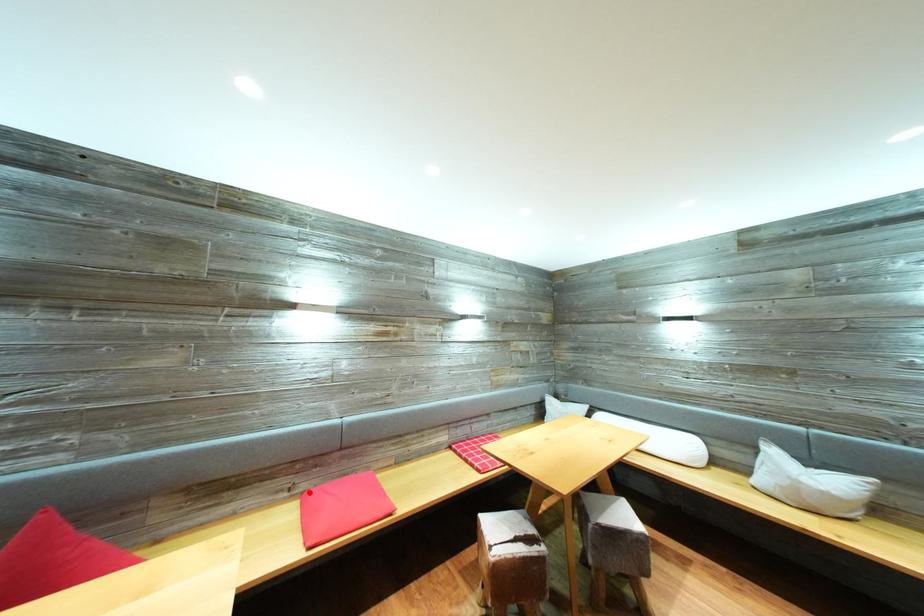
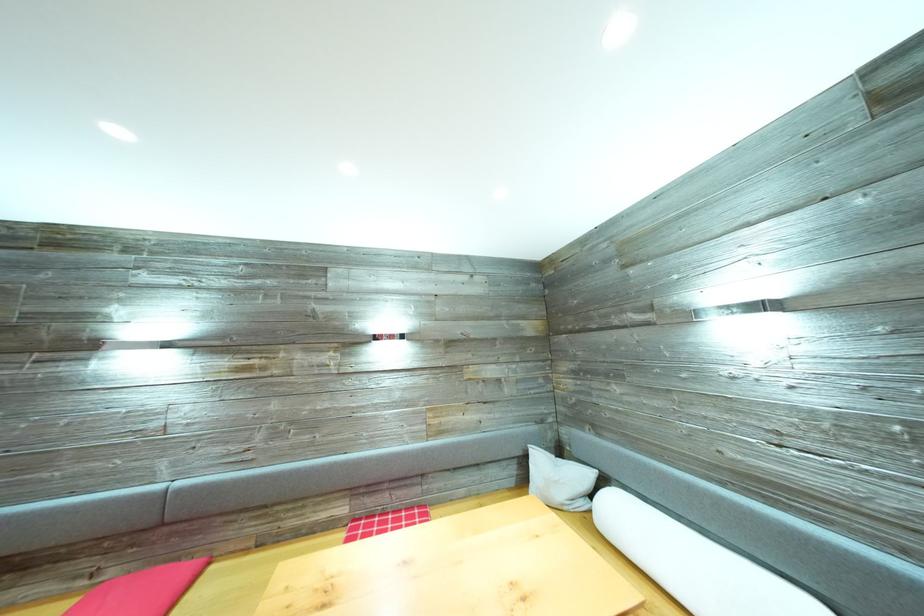
Find the pixel in the second image that matches the highlighted location in the first image.

(117, 578)